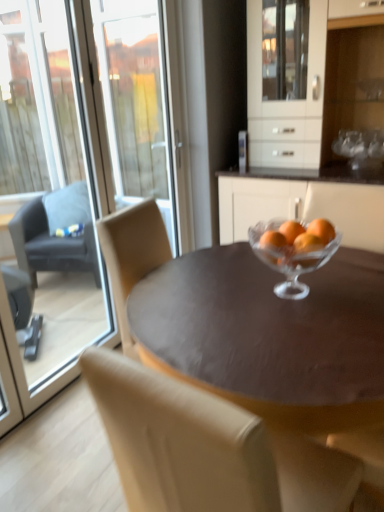
Question: Is orangesmooth glassbowl at center surrounded by dark gray fabric chair at left, which ranks as the 2th chair in bottom-to-top order?

Choices:
 (A) no
 (B) yes

Answer: (A)

Question: Is dark gray fabric chair at left, which ranks as the 2th chair in bottom-to-top order, further to the viewer compared to orangesmooth glassbowl at center?

Choices:
 (A) no
 (B) yes

Answer: (B)

Question: Considering the relative positions of dark gray fabric chair at left, arranged as the 1th chair when viewed from the back, and orangesmooth glassbowl at center in the image provided, is dark gray fabric chair at left, arranged as the 1th chair when viewed from the back, to the right of orangesmooth glassbowl at center from the viewer's perspective?

Choices:
 (A) yes
 (B) no

Answer: (B)

Question: Can you confirm if dark gray fabric chair at left, the 1th chair from the top, is wider than orangesmooth glassbowl at center?

Choices:
 (A) no
 (B) yes

Answer: (B)

Question: Can you confirm if dark gray fabric chair at left, which is counted as the 2th chair, starting from the right, is thinner than orangesmooth glassbowl at center?

Choices:
 (A) yes
 (B) no

Answer: (B)

Question: Is beige leather chair at center, arranged as the 1th chair when ordered from the bottom, in front of or behind white glossy cabinet at upper center in the image?

Choices:
 (A) behind
 (B) front

Answer: (B)

Question: Considering the positions of beige leather chair at center, the second chair positioned from the top, and white glossy cabinet at upper center in the image, is beige leather chair at center, the second chair positioned from the top, taller or shorter than white glossy cabinet at upper center?

Choices:
 (A) tall
 (B) short

Answer: (B)

Question: Considering the positions of beige leather chair at center, the second chair from the back, and white glossy cabinet at upper center in the image, is beige leather chair at center, the second chair from the back, bigger or smaller than white glossy cabinet at upper center?

Choices:
 (A) small
 (B) big

Answer: (A)

Question: Visually, is beige leather chair at center, marked as the second chair in a left-to-right arrangement, positioned to the left or to the right of white glossy cabinet at upper center?

Choices:
 (A) left
 (B) right

Answer: (A)

Question: Is beige leather chair at center, arranged as the 1th chair when ordered from the bottom, wider or thinner than dark gray fabric chair at left, which appears as the first chair when viewed from the left?

Choices:
 (A) thin
 (B) wide

Answer: (B)

Question: Would you say beige leather chair at center, the second chair positioned from the top, is to the left or to the right of dark gray fabric chair at left, which ranks as the 2th chair in bottom-to-top order, in the picture?

Choices:
 (A) right
 (B) left

Answer: (A)

Question: From a real-world perspective, is beige leather chair at center, the 1th chair viewed from the front, physically located above or below dark gray fabric chair at left, which ranks as the 2th chair in bottom-to-top order?

Choices:
 (A) below
 (B) above

Answer: (B)

Question: In terms of height, does beige leather chair at center, the second chair from the back, look taller or shorter compared to dark gray fabric chair at left, arranged as the 1th chair when viewed from the back?

Choices:
 (A) tall
 (B) short

Answer: (A)

Question: In terms of size, does dark gray fabric chair at left, which ranks as the 2th chair in bottom-to-top order, appear bigger or smaller than orangesmooth glassbowl at center?

Choices:
 (A) big
 (B) small

Answer: (A)

Question: In terms of width, does dark gray fabric chair at left, arranged as the 1th chair when viewed from the back, look wider or thinner when compared to orangesmooth glassbowl at center?

Choices:
 (A) thin
 (B) wide

Answer: (B)